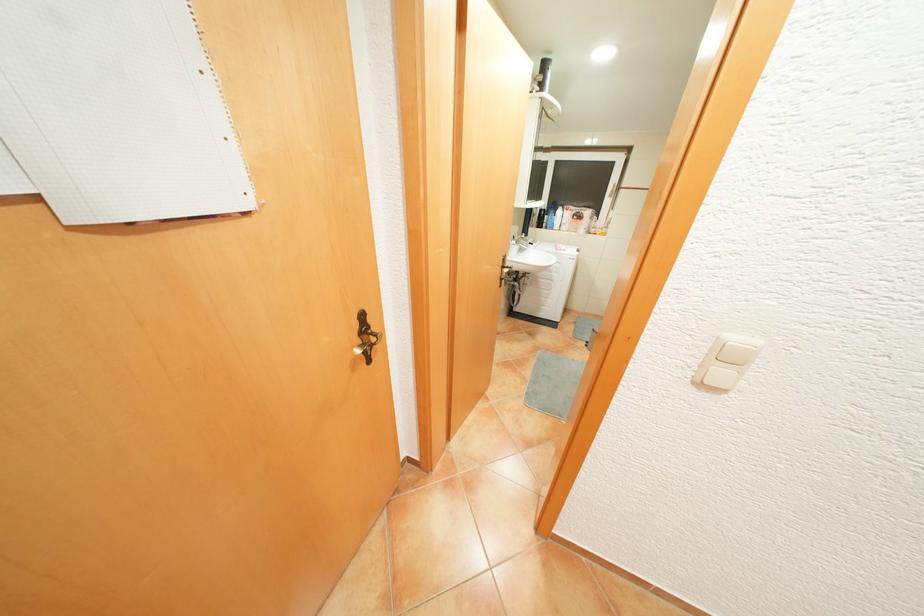
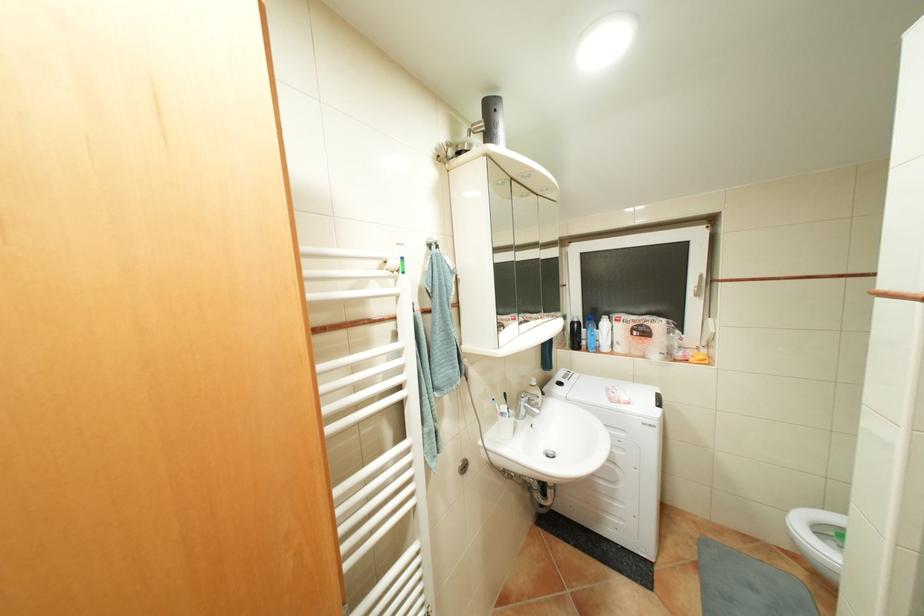
The point at (524, 241) is marked in the first image. Where is the corresponding point in the second image?

(514, 408)